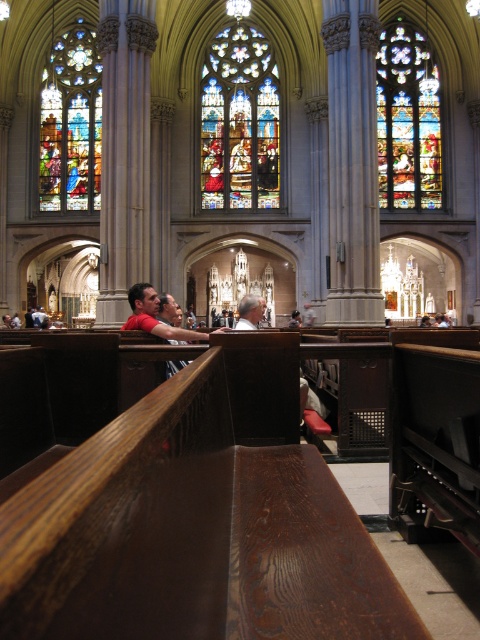
Between multicolored stained glass at center and stained glass window at upper left, which one has more height?

stained glass window at upper left is taller.

Which is behind, point (252, 49) or point (80, 177)?

The point (252, 49) is behind.

Is point (220, 100) in front of point (58, 157)?

No, (220, 100) is behind (58, 157).

Find the location of a particular element. multicolored stained glass at center is located at coordinates (240, 122).

Who is positioned more to the right, multicolored stained glass at center or stained glass window at upper right?

stained glass window at upper right

Between point (203, 180) and point (391, 156), which one is positioned behind?

Point (391, 156)

Identify the location of multicolored stained glass at center. This screenshot has width=480, height=640. (240, 122).

Is stained glass window at upper right further to the viewer compared to stained glass window at upper left?

No, stained glass window at upper right is closer to the viewer.

Can you confirm if stained glass window at upper right is thinner than stained glass window at upper left?

Yes.

Between point (379, 109) and point (43, 136), which one is positioned behind?

Point (43, 136)

This screenshot has height=640, width=480. Find the location of `stained glass window at upper right`. stained glass window at upper right is located at coordinates (408, 120).